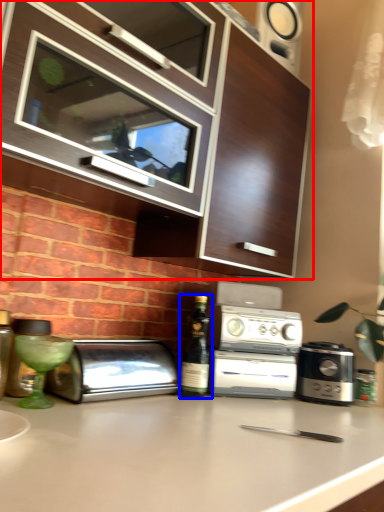
Question: Among these objects, which one is farthest to the camera, cabinetry (highlighted by a red box) or wine bottle (highlighted by a blue box)?

Choices:
 (A) cabinetry
 (B) wine bottle

Answer: (B)